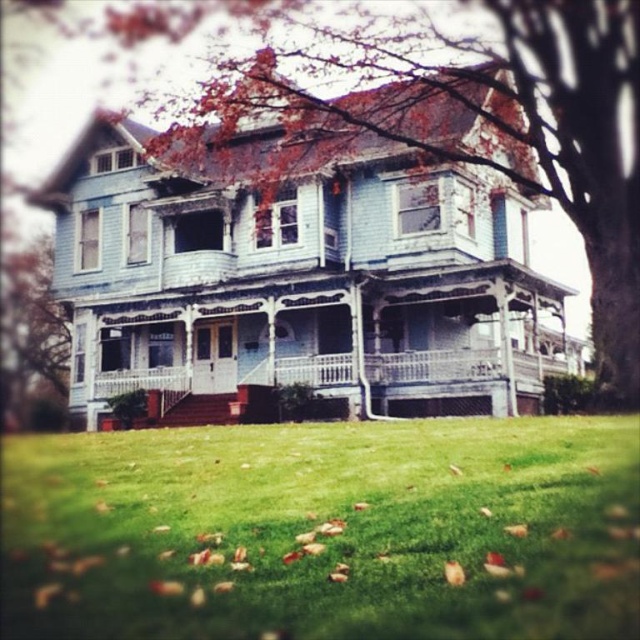
Question: Among these objects, which one is farthest from the camera?

Choices:
 (A) green leafy tree at left
 (B) green grass at lower center
 (C) smooth bark tree at upper center

Answer: (A)

Question: Can you confirm if smooth bark tree at upper center is positioned to the left of green leafy tree at left?

Choices:
 (A) no
 (B) yes

Answer: (A)

Question: From the image, what is the correct spatial relationship of smooth bark tree at upper center in relation to green leafy tree at left?

Choices:
 (A) above
 (B) below

Answer: (A)

Question: Which point appears farthest from the camera in this image?

Choices:
 (A) (60, 374)
 (B) (534, 570)

Answer: (A)

Question: Estimate the real-world distances between objects in this image. Which object is closer to the green leafy tree at left?

Choices:
 (A) smooth bark tree at upper center
 (B) green grass at lower center

Answer: (A)

Question: Does smooth bark tree at upper center appear under green leafy tree at left?

Choices:
 (A) yes
 (B) no

Answer: (B)